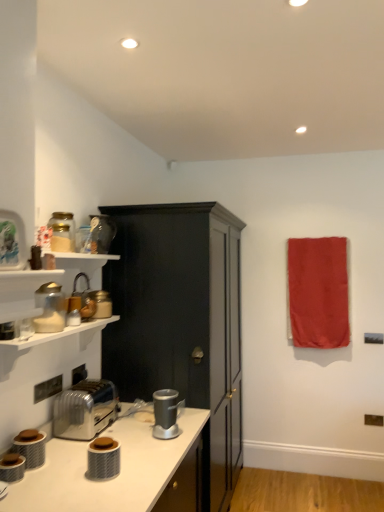
Question: Could you tell me if silver metallic toaster at lower left is facing red fabric towel at upper right?

Choices:
 (A) yes
 (B) no

Answer: (B)

Question: Is red fabric towel at upper right completely or partially inside silver metallic toaster at lower left?

Choices:
 (A) no
 (B) yes

Answer: (A)

Question: Does silver metallic toaster at lower left appear on the right side of red fabric towel at upper right?

Choices:
 (A) no
 (B) yes

Answer: (A)

Question: Does silver metallic toaster at lower left have a larger size compared to red fabric towel at upper right?

Choices:
 (A) no
 (B) yes

Answer: (A)

Question: From the image's perspective, does silver metallic toaster at lower left appear lower than red fabric towel at upper right?

Choices:
 (A) yes
 (B) no

Answer: (A)

Question: Does silver metallic toaster at lower left have a greater height compared to red fabric towel at upper right?

Choices:
 (A) yes
 (B) no

Answer: (B)

Question: From the image's perspective, is silver metallic toaster at lower left located above metallic silver kettle at left, the 2th appliance from the top?

Choices:
 (A) yes
 (B) no

Answer: (B)

Question: From the image's perspective, is silver metallic toaster at lower left under metallic silver kettle at left, the 6th appliance when ordered from bottom to top?

Choices:
 (A) yes
 (B) no

Answer: (A)

Question: Is silver metallic toaster at lower left to the right of metallic silver kettle at left, the 2th appliance from the top, from the viewer's perspective?

Choices:
 (A) no
 (B) yes

Answer: (B)

Question: Is silver metallic toaster at lower left aimed at metallic silver kettle at left, marked as the fifth appliance in a front-to-back arrangement?

Choices:
 (A) yes
 (B) no

Answer: (B)

Question: Is silver metallic toaster at lower left surrounding metallic silver kettle at left, marked as the fifth appliance in a front-to-back arrangement?

Choices:
 (A) no
 (B) yes

Answer: (A)

Question: Considering the relative sizes of silver metallic toaster at lower left and metallic silver kettle at left, marked as the fifth appliance in a front-to-back arrangement, in the image provided, is silver metallic toaster at lower left smaller than metallic silver kettle at left, marked as the fifth appliance in a front-to-back arrangement,?

Choices:
 (A) yes
 (B) no

Answer: (B)

Question: Is matte black canister at lower center, which is the second appliance in front-to-back order, bigger than matte white blender at left, the fifth appliance positioned from the bottom?

Choices:
 (A) no
 (B) yes

Answer: (A)